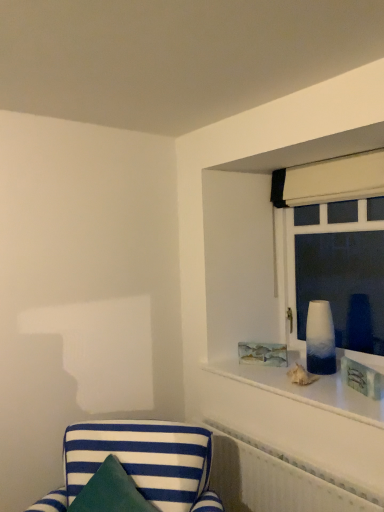
Image resolution: width=384 pixels, height=512 pixels. Identify the location of free space above white fabric curtain at upper right (from a real-world perspective). (342, 155).